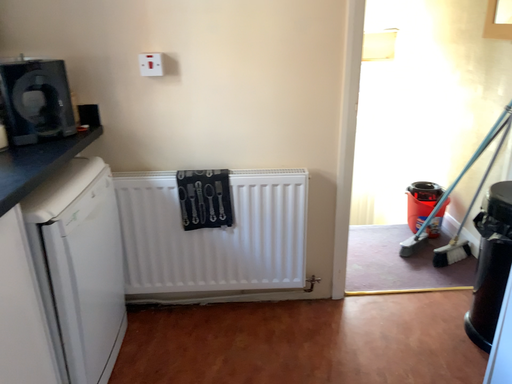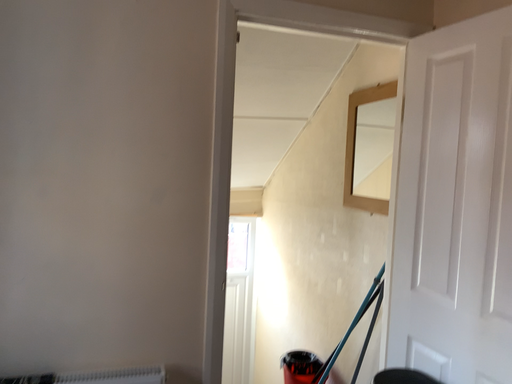
Question: Which way did the camera rotate in the video?

Choices:
 (A) rotated downward
 (B) rotated upward

Answer: (B)